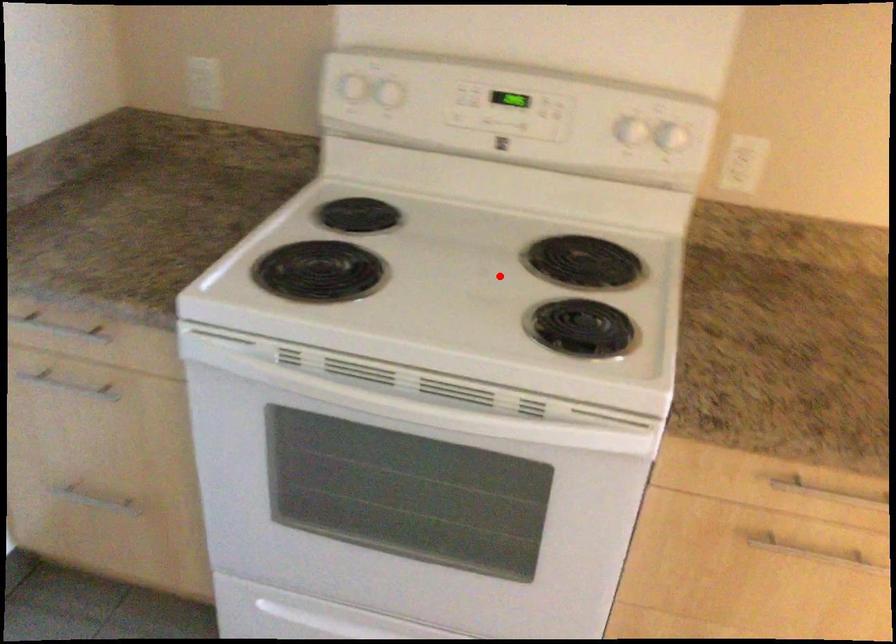
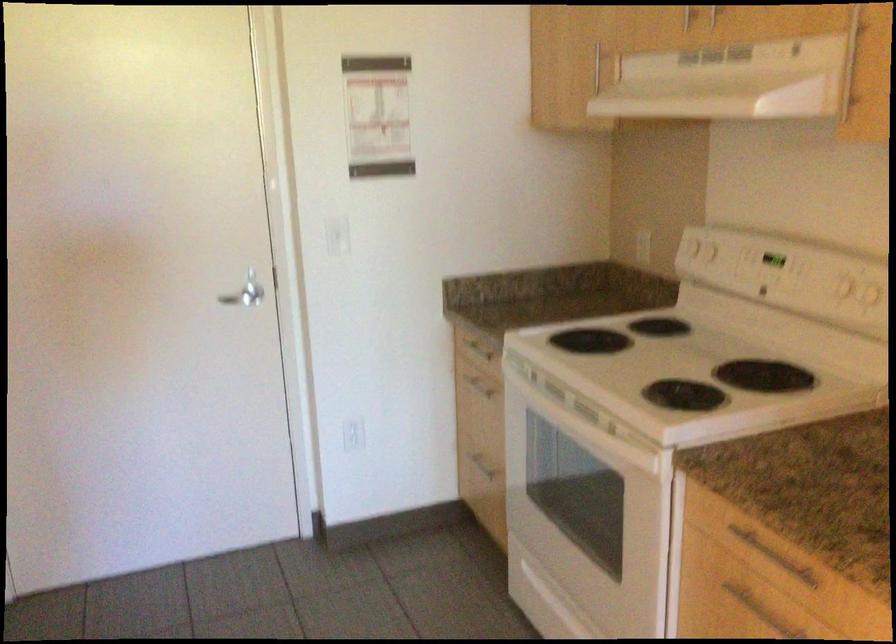
Locate, in the second image, the point that corresponds to the highlighted location in the first image.

(686, 365)